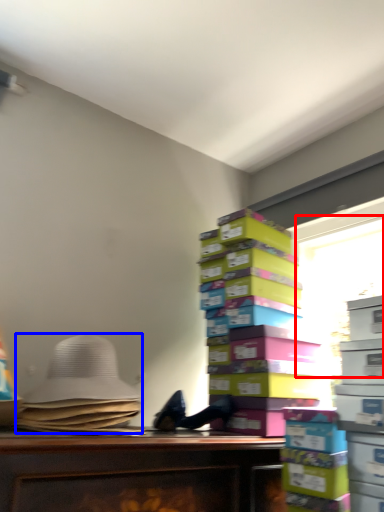
Question: Which object appears farthest to the camera in this image, window screen (highlighted by a red box) or wide (highlighted by a blue box)?

Choices:
 (A) window screen
 (B) wide

Answer: (A)